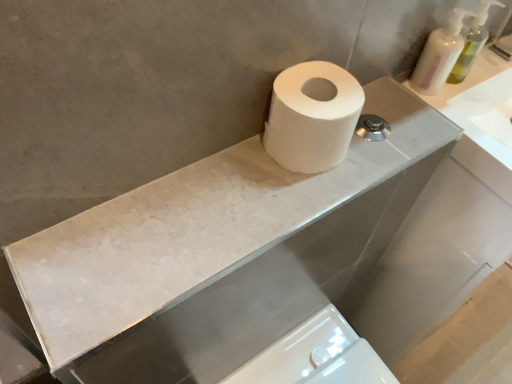
Question: Is white matte toilet paper at center bigger than white marble counter top at upper center?

Choices:
 (A) yes
 (B) no

Answer: (B)

Question: From a real-world perspective, is white matte toilet paper at center positioned over white marble counter top at upper center based on gravity?

Choices:
 (A) yes
 (B) no

Answer: (A)

Question: Considering the relative sizes of white matte toilet paper at center and white marble counter top at upper center in the image provided, is white matte toilet paper at center taller than white marble counter top at upper center?

Choices:
 (A) no
 (B) yes

Answer: (B)

Question: Does white matte toilet paper at center have a lesser height compared to white marble counter top at upper center?

Choices:
 (A) yes
 (B) no

Answer: (B)

Question: Does white matte toilet paper at center have a greater width compared to white marble counter top at upper center?

Choices:
 (A) no
 (B) yes

Answer: (A)

Question: Does point (309, 104) appear closer or farther from the camera than point (465, 72)?

Choices:
 (A) farther
 (B) closer

Answer: (B)

Question: Is white matte toilet paper at center in front of or behind translucent plastic soap dispenser at upper right, which is the 2th soap dispenser from left to right, in the image?

Choices:
 (A) front
 (B) behind

Answer: (A)

Question: Do you think white matte toilet paper at center is within translucent plastic soap dispenser at upper right, which is the 2th soap dispenser from left to right, or outside of it?

Choices:
 (A) inside
 (B) outside

Answer: (B)

Question: From a real-world perspective, relative to translucent plastic soap dispenser at upper right, which is the 1th soap dispenser from right to left, is white matte toilet paper at center vertically above or below?

Choices:
 (A) below
 (B) above

Answer: (B)

Question: Is white glossy bidet at lower center taller or shorter than white matte toilet paper at center?

Choices:
 (A) tall
 (B) short

Answer: (A)

Question: In the image, is white glossy bidet at lower center positioned in front of or behind white matte toilet paper at center?

Choices:
 (A) behind
 (B) front

Answer: (A)

Question: Based on their positions, is white glossy bidet at lower center located to the left or right of white matte toilet paper at center?

Choices:
 (A) right
 (B) left

Answer: (A)

Question: Is white glossy bidet at lower center spatially inside white matte toilet paper at center, or outside of it?

Choices:
 (A) inside
 (B) outside

Answer: (B)

Question: Is white marble counter top at upper center to the left or to the right of white matte toilet paper at center in the image?

Choices:
 (A) left
 (B) right

Answer: (A)

Question: From the image's perspective, relative to white matte toilet paper at center, is white marble counter top at upper center above or below?

Choices:
 (A) above
 (B) below

Answer: (B)